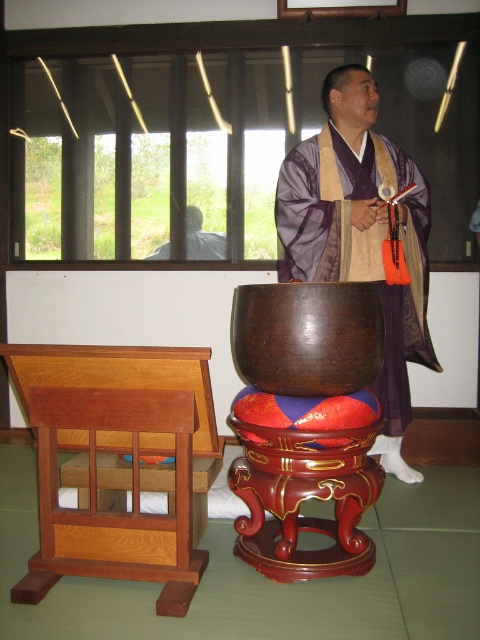
Based on the scene description, where is the wooden altar at center located in terms of its 2D coordinates?

The wooden altar at center is located at the 2D coordinates point (126, 465).